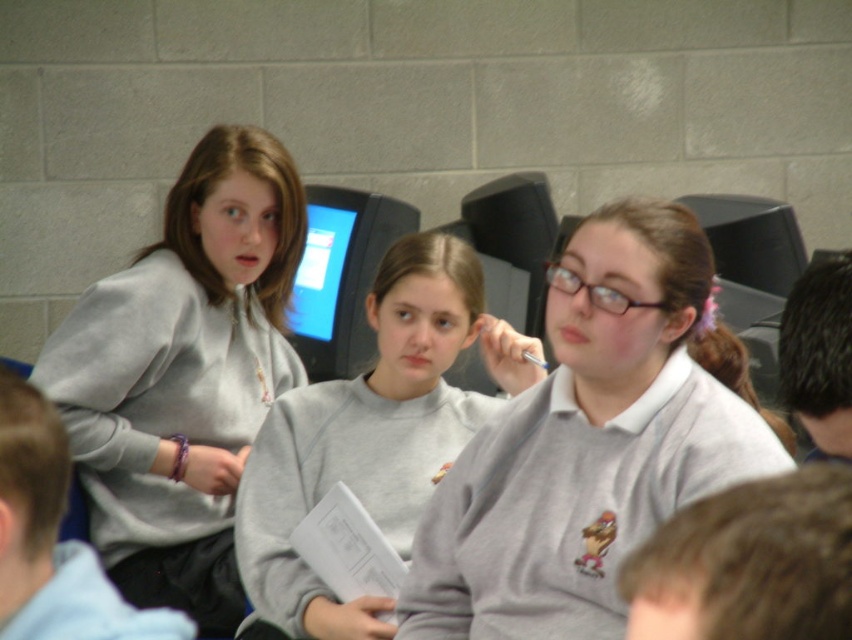
Who is taller, matte gray sweater at center or brown hair at lower right?

matte gray sweater at center

Does point (537, 385) come closer to viewer compared to point (770, 534)?

No.

Describe the element at coordinates (586, 444) in the screenshot. The height and width of the screenshot is (640, 852). I see `matte gray sweater at center` at that location.

At what (x,y) coordinates should I click in order to perform the action: click on matte gray sweater at center. Please return your answer as a coordinate pair (x, y). Image resolution: width=852 pixels, height=640 pixels. Looking at the image, I should click on (586, 444).

Between point (250, 195) and point (698, 632), which one is positioned in front?

Positioned in front is point (698, 632).

Identify the location of gray sweatshirt at left. (183, 374).

Image resolution: width=852 pixels, height=640 pixels. What are the coordinates of `gray sweatshirt at left` in the screenshot? It's located at (183, 374).

Identify the location of gray sweatshirt at left. This screenshot has height=640, width=852. (183, 374).

Is matte gray sweater at center further to camera compared to shiny plastic monitor at center?

No, matte gray sweater at center is in front of shiny plastic monitor at center.

Is matte gray sweater at center thinner than shiny plastic monitor at center?

In fact, matte gray sweater at center might be wider than shiny plastic monitor at center.

Locate an element on the screen. This screenshot has height=640, width=852. matte gray sweater at center is located at coordinates (586, 444).

Find the location of a particular element. The height and width of the screenshot is (640, 852). matte gray sweater at center is located at coordinates (586, 444).